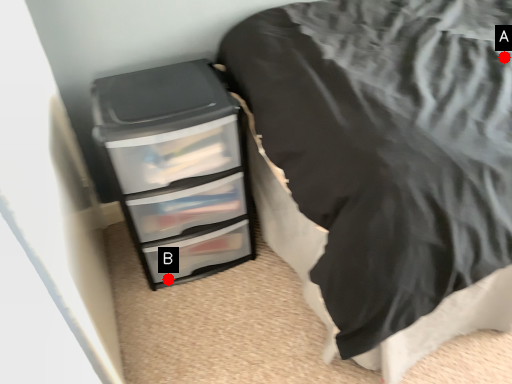
Question: Two points are circled on the image, labeled by A and B beside each circle. Which point appears closest to the camera in this image?

Choices:
 (A) A is closer
 (B) B is closer

Answer: (A)